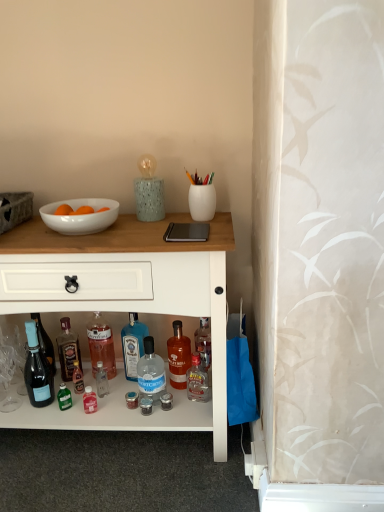
Where is `free space above white glossy cabinet at center (from a real-world perspective)`? The height and width of the screenshot is (512, 384). free space above white glossy cabinet at center (from a real-world perspective) is located at coordinates (105, 231).